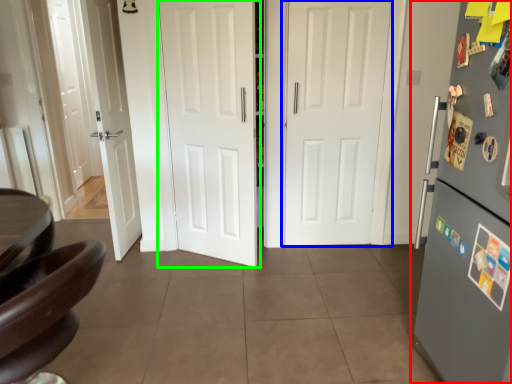
Question: Estimate the real-world distances between objects in this image. Which object is farther from refrigerator (highlighted by a red box), door (highlighted by a blue box) or door (highlighted by a green box)?

Choices:
 (A) door
 (B) door

Answer: (B)